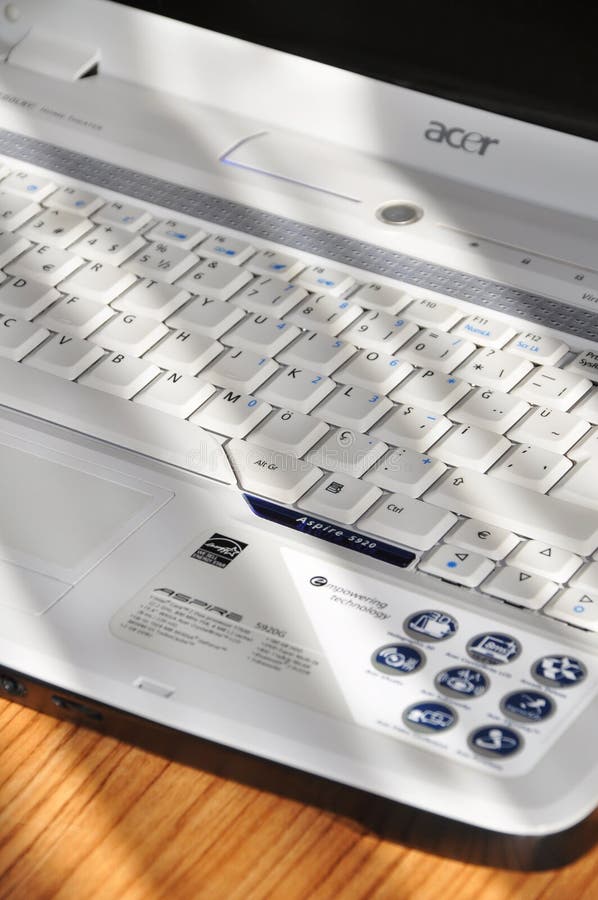
In order to click on table in this screenshot , I will do `click(91, 816)`.